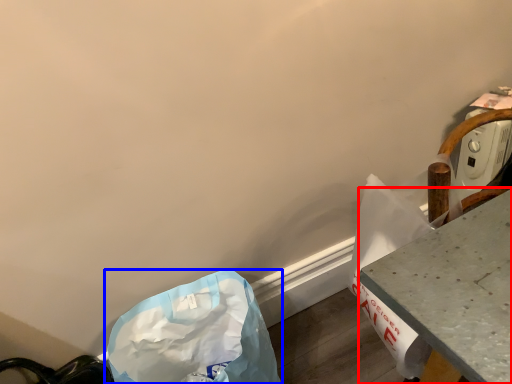
Question: Which object appears farthest to the camera in this image, table (highlighted by a red box) or plastic bag (highlighted by a blue box)?

Choices:
 (A) table
 (B) plastic bag

Answer: (B)